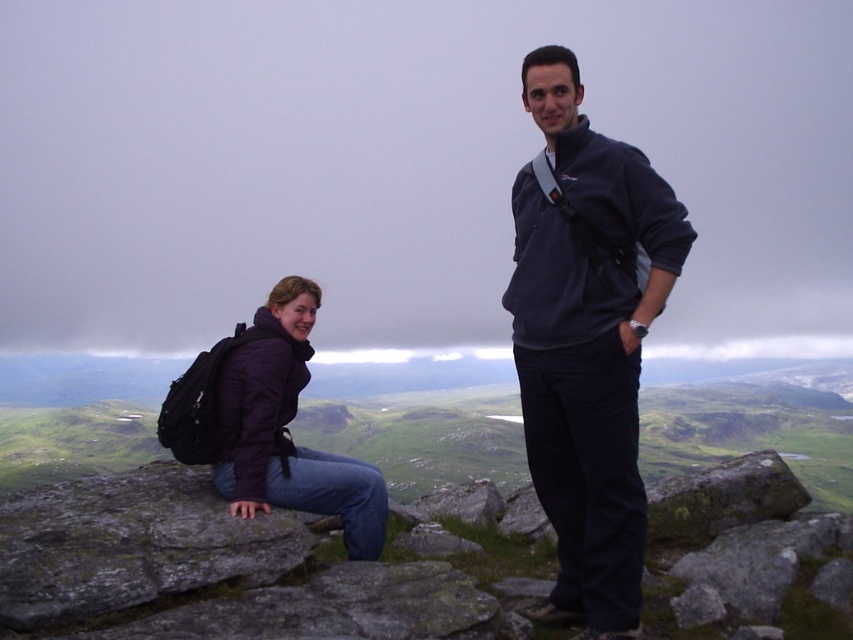
You are trying to decide which jacket to wear for a hike. The navy fleece jacket at center and the matte purple jacket at left are both options. Based on their sizes, which one would be more suitable for carrying a backpack?

The navy fleece jacket at center is bigger than the matte purple jacket at left, so it would be more suitable for carrying a backpack as it likely has more space for movement and storage.

You are a photographer trying to capture a photo of both the purple softshell jacket at upper center and the matte purple jacket at left in the same frame. Based on their positions, which jacket should you focus on first to ensure both are in the shot?

You should focus on the matte purple jacket at left first because the purple softshell jacket at upper center is positioned to its right, so by centering the matte purple jacket at left, the other jacket will naturally fall into the frame.

You are planning to buy a jacket similar to the ones in the image. The navy fleece jacket at center and the matte purple jacket at left are both options. Which one has a wider design?

The navy fleece jacket at center has a wider design than the matte purple jacket at left.